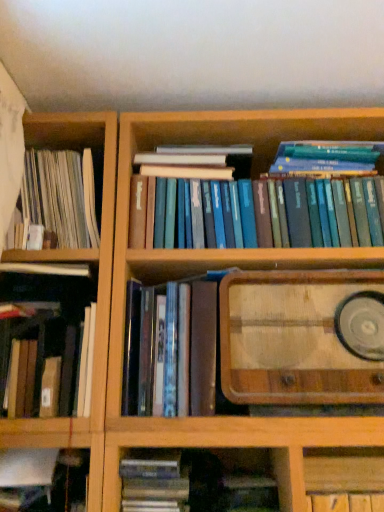
Question: Does wooden cabinet at lower right have a larger size compared to hardcover book at center, the 4th book when ordered from left to right?

Choices:
 (A) no
 (B) yes

Answer: (A)

Question: Considering the relative sizes of wooden cabinet at lower right and hardcover book at center, positioned as the third book in right-to-left order, in the image provided, is wooden cabinet at lower right smaller than hardcover book at center, positioned as the third book in right-to-left order,?

Choices:
 (A) yes
 (B) no

Answer: (A)

Question: From a real-world perspective, does wooden cabinet at lower right stand above hardcover book at center, the 4th book when ordered from left to right?

Choices:
 (A) yes
 (B) no

Answer: (B)

Question: Is wooden cabinet at lower right thinner than hardcover book at center, the 4th book when ordered from left to right?

Choices:
 (A) yes
 (B) no

Answer: (A)

Question: Is hardcover book at center, the 4th book when ordered from left to right, at the back of wooden cabinet at lower right?

Choices:
 (A) yes
 (B) no

Answer: (B)

Question: Is wooden cabinet at lower right wider than hardcover book at center, the 4th book when ordered from left to right?

Choices:
 (A) no
 (B) yes

Answer: (A)

Question: Is hardcover book at left, the third book when ordered from left to right, behind hardcover book at center, positioned as the third book in right-to-left order?

Choices:
 (A) no
 (B) yes

Answer: (B)

Question: Would you say hardcover book at center, the 4th book when ordered from left to right, is part of hardcover book at left, which is counted as the 4th book, starting from the right,'s contents?

Choices:
 (A) yes
 (B) no

Answer: (B)

Question: From a real-world perspective, is hardcover book at left, which is counted as the 4th book, starting from the right, positioned under hardcover book at center, the 4th book when ordered from left to right, based on gravity?

Choices:
 (A) yes
 (B) no

Answer: (B)

Question: Is hardcover book at left, the third book when ordered from left to right, taller than hardcover book at center, positioned as the third book in right-to-left order?

Choices:
 (A) yes
 (B) no

Answer: (A)

Question: Considering the relative sizes of hardcover book at left, the third book when ordered from left to right, and hardcover book at center, positioned as the third book in right-to-left order, in the image provided, is hardcover book at left, the third book when ordered from left to right, shorter than hardcover book at center, positioned as the third book in right-to-left order,?

Choices:
 (A) no
 (B) yes

Answer: (A)

Question: Could you tell me if hardcover book at left, which is counted as the 4th book, starting from the right, is turned towards hardcover book at center, the 4th book when ordered from left to right?

Choices:
 (A) no
 (B) yes

Answer: (A)

Question: Is wooden cabinet at lower right further to the viewer compared to hardcover book at lower left, the fifth book positioned from the right?

Choices:
 (A) yes
 (B) no

Answer: (A)